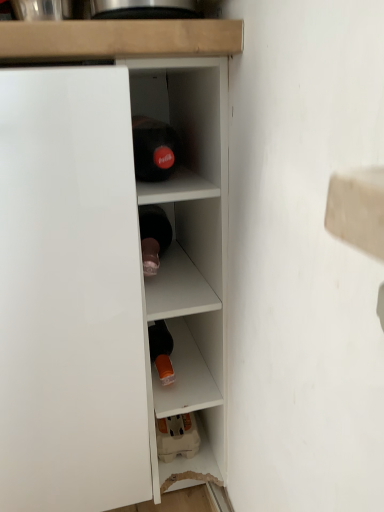
You are a GUI agent. You are given a task and a screenshot of the screen. Output one action in this format:
    pyautogui.click(x=<x>, y=<y>)
    Task: Click on the white glossy cabinet at center
    This screenshot has height=512, width=384.
    Given the screenshot: What is the action you would take?
    [x=189, y=254]

This screenshot has width=384, height=512. What do you see at coordinates (189, 254) in the screenshot? I see `white glossy cabinet at center` at bounding box center [189, 254].

What do you see at coordinates (109, 260) in the screenshot?
I see `white glossy cupboard at left` at bounding box center [109, 260].

Where is `white glossy cupboard at left`? white glossy cupboard at left is located at coordinates (109, 260).

Identify the location of white glossy cabinet at center. (189, 254).

Is white glossy cupboard at left at the left side of white glossy cabinet at center?

Indeed, white glossy cupboard at left is positioned on the left side of white glossy cabinet at center.

Is white glossy cupboard at left positioned behind white glossy cabinet at center?

No, it is not.

Is point (114, 329) closer or farther from the camera than point (203, 163)?

Point (114, 329) is positioned closer to the camera compared to point (203, 163).

From the image's perspective, is white glossy cupboard at left below white glossy cabinet at center?

Yes.

From a real-world perspective, is white glossy cupboard at left located higher than white glossy cabinet at center?

Actually, white glossy cupboard at left is physically below white glossy cabinet at center in the real world.

Considering the sizes of objects white glossy cupboard at left and white glossy cabinet at center in the image provided, who is thinner, white glossy cupboard at left or white glossy cabinet at center?

white glossy cabinet at center.

Considering the relative sizes of white glossy cupboard at left and white glossy cabinet at center in the image provided, is white glossy cupboard at left shorter than white glossy cabinet at center?

Yes, white glossy cupboard at left is shorter than white glossy cabinet at center.

Based on their sizes in the image, would you say white glossy cupboard at left is bigger or smaller than white glossy cabinet at center?

white glossy cupboard at left is bigger than white glossy cabinet at center.

Could white glossy cabinet at center be considered to be inside white glossy cupboard at left?

That's incorrect, white glossy cabinet at center is not inside white glossy cupboard at left.

Is white glossy cupboard at left positioned far away from white glossy cabinet at center?

white glossy cupboard at left is actually quite close to white glossy cabinet at center.

Is white glossy cupboard at left oriented towards white glossy cabinet at center?

No, white glossy cupboard at left is not aimed at white glossy cabinet at center.

Can you tell me how much white glossy cupboard at left and white glossy cabinet at center differ in facing direction?

0.433 degrees.

How much distance is there between white glossy cupboard at left and white glossy cabinet at center?

white glossy cupboard at left is 2.23 inches from white glossy cabinet at center.

I want to click on cupboard in front of the white glossy cabinet at center, so click(109, 260).

Is white glossy cabinet at center to the left of white glossy cupboard at left from the viewer's perspective?

Incorrect, white glossy cabinet at center is not on the left side of white glossy cupboard at left.

Considering the relative positions of white glossy cabinet at center and white glossy cupboard at left in the image provided, is white glossy cabinet at center behind white glossy cupboard at left?

Yes, white glossy cabinet at center is further from the viewer.

Is point (181, 250) positioned in front of point (190, 241)?

No, (181, 250) is further to viewer.

From the image's perspective, which object appears higher, white glossy cabinet at center or white glossy cupboard at left?

white glossy cabinet at center.

From a real-world perspective, which is physically above, white glossy cabinet at center or white glossy cupboard at left?

In real-world perspective, white glossy cabinet at center is above.

Does white glossy cabinet at center have a greater width compared to white glossy cupboard at left?

In fact, white glossy cabinet at center might be narrower than white glossy cupboard at left.

Can you confirm if white glossy cabinet at center is shorter than white glossy cupboard at left?

No, white glossy cabinet at center is not shorter than white glossy cupboard at left.

Consider the image. Between white glossy cabinet at center and white glossy cupboard at left, which one has smaller size?

With smaller size is white glossy cabinet at center.

Is white glossy cabinet at center located outside white glossy cupboard at left?

white glossy cabinet at center lies outside white glossy cupboard at left's area.

Does white glossy cabinet at center touch white glossy cupboard at left?

Yes, white glossy cabinet at center is right next to white glossy cupboard at left and making contact.

Is white glossy cabinet at center turned away from white glossy cupboard at left?

No, white glossy cupboard at left is not at the back of white glossy cabinet at center.

Identify the location of cupboard below the white glossy cabinet at center (from the image's perspective). (109, 260).

Locate an element on the screen. The image size is (384, 512). cabinet located behind the white glossy cupboard at left is located at coordinates (189, 254).

Locate an element on the screen. Image resolution: width=384 pixels, height=512 pixels. cupboard located in front of the white glossy cabinet at center is located at coordinates (109, 260).